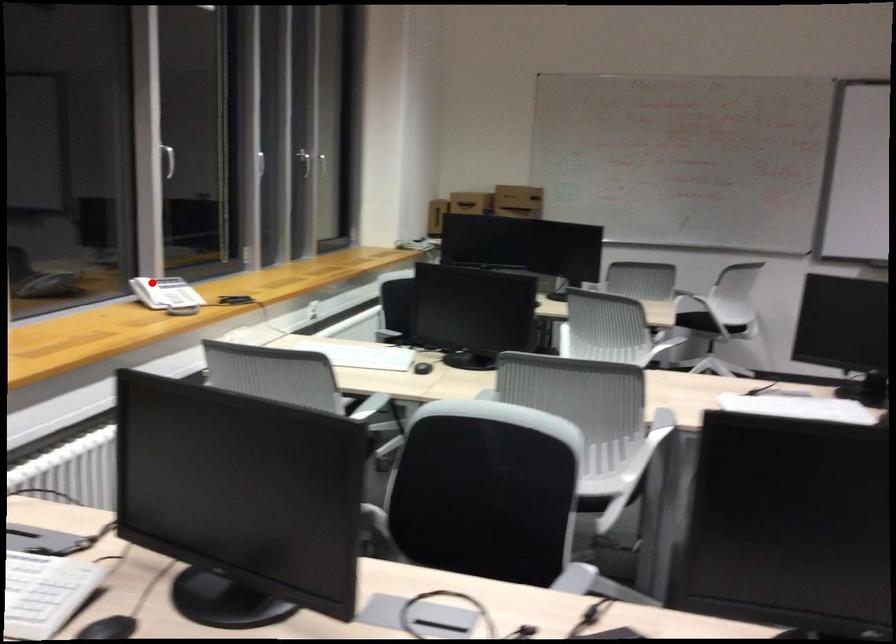
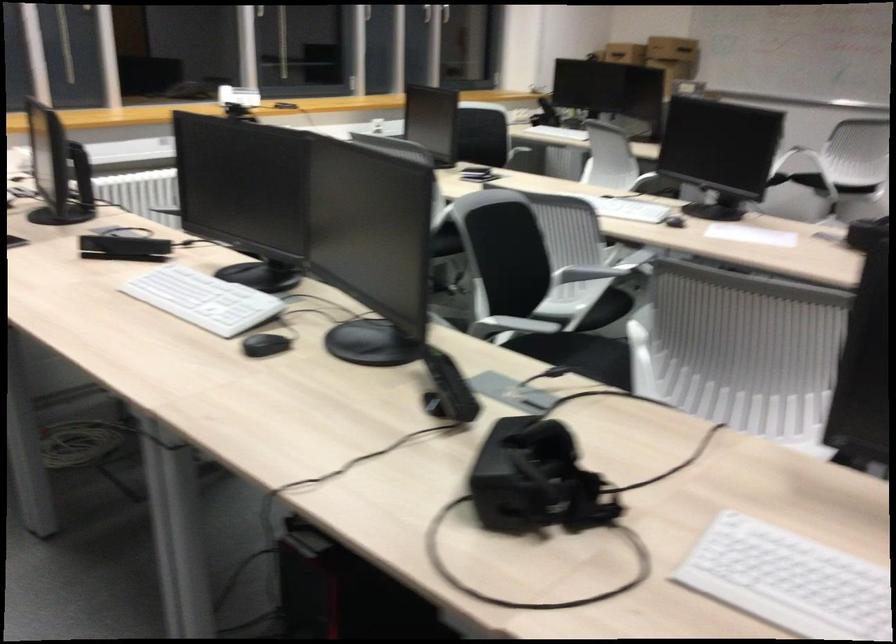
Where in the second image is the point corresponding to the highlighted location from the first image?

(238, 96)